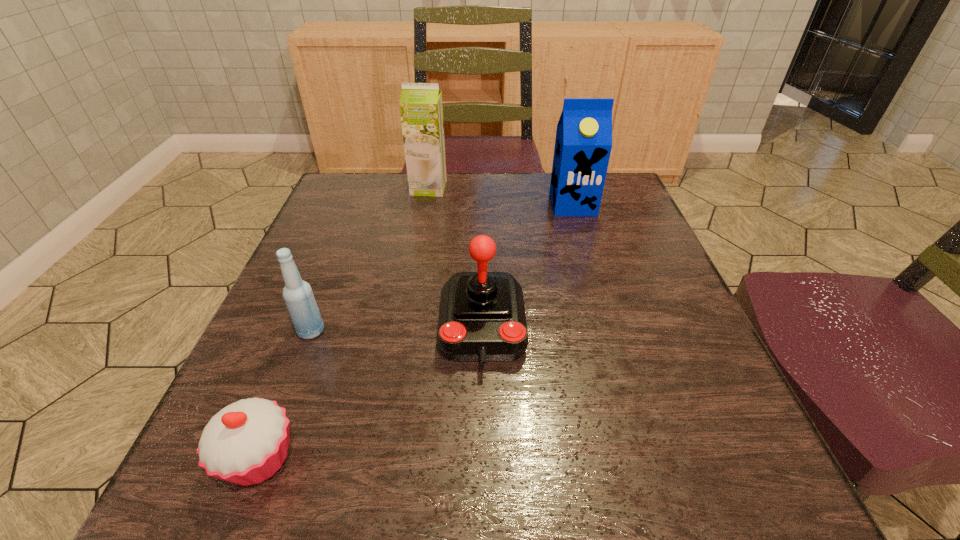
Locate an element on the screen. vacant area situated on the back of the shortest object is located at coordinates (307, 335).

Image resolution: width=960 pixels, height=540 pixels. Identify the location of soya milk positioned at the far edge. (421, 109).

Where is `carton located in the far edge section of the desktop`? This screenshot has width=960, height=540. carton located in the far edge section of the desktop is located at coordinates (583, 143).

Identify the location of object at the near edge. Image resolution: width=960 pixels, height=540 pixels. coord(246,442).

Locate an element on the screen. bottle present at the left edge is located at coordinates click(x=298, y=296).

The width and height of the screenshot is (960, 540). Find the location of `cupcake that is at the left edge`. cupcake that is at the left edge is located at coordinates (246, 442).

Identify the location of object located at the right edge. (583, 143).

What are the coordinates of `object that is at the near left corner` in the screenshot? It's located at (246, 442).

What are the coordinates of `object at the far right corner` in the screenshot? It's located at (583, 143).

Identify the location of vacant space at the far edge of the desktop. (475, 213).